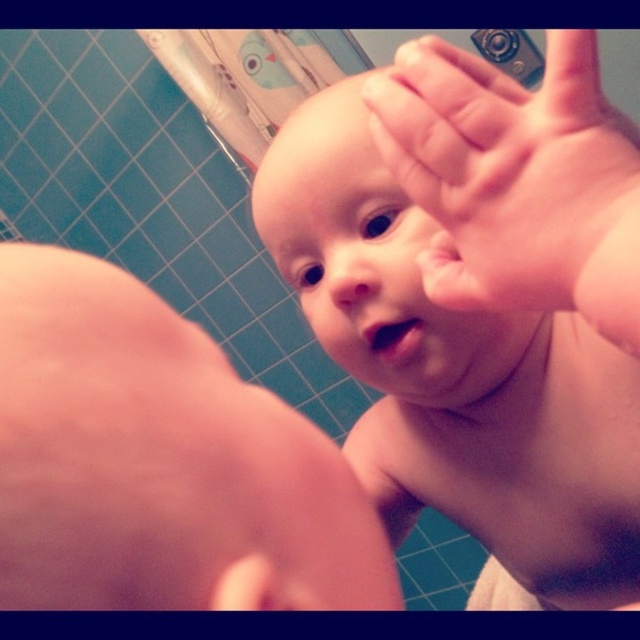
Question: Which point is farther from the camera taking this photo?

Choices:
 (A) (506, 381)
 (B) (452, 164)
 (C) (324, 589)

Answer: (A)

Question: Is pink flesh baby at center closer to camera compared to pink flesh at lower left?

Choices:
 (A) no
 (B) yes

Answer: (A)

Question: Which of the following is the farthest from the observer?

Choices:
 (A) pink flesh at lower left
 (B) pink flesh baby at center
 (C) pink flesh hand at upper center

Answer: (B)

Question: Can you confirm if pink flesh at lower left is positioned to the left of pink flesh hand at upper center?

Choices:
 (A) no
 (B) yes

Answer: (B)

Question: Based on their relative distances, which object is nearer to the pink flesh baby at center?

Choices:
 (A) pink flesh hand at upper center
 (B) pink flesh at lower left

Answer: (A)

Question: In this image, where is pink flesh at lower left located relative to pink flesh hand at upper center?

Choices:
 (A) left
 (B) right

Answer: (A)